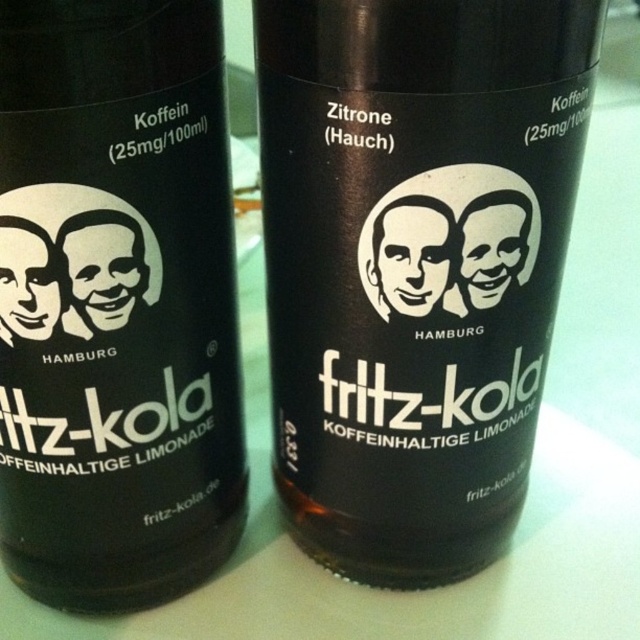
Question: Is black matte bottle at center to the left of brown glass bottle at center from the viewer's perspective?

Choices:
 (A) no
 (B) yes

Answer: (A)

Question: Which point appears farthest from the camera in this image?

Choices:
 (A) (13, 100)
 (B) (552, 108)

Answer: (B)

Question: Which of the following is the closest to the observer?

Choices:
 (A) (365, 321)
 (B) (120, 129)

Answer: (B)

Question: Considering the relative positions of black matte bottle at center and brown glass bottle at center in the image provided, where is black matte bottle at center located with respect to brown glass bottle at center?

Choices:
 (A) below
 (B) above

Answer: (B)

Question: Does black matte bottle at center come in front of brown glass bottle at center?

Choices:
 (A) no
 (B) yes

Answer: (A)